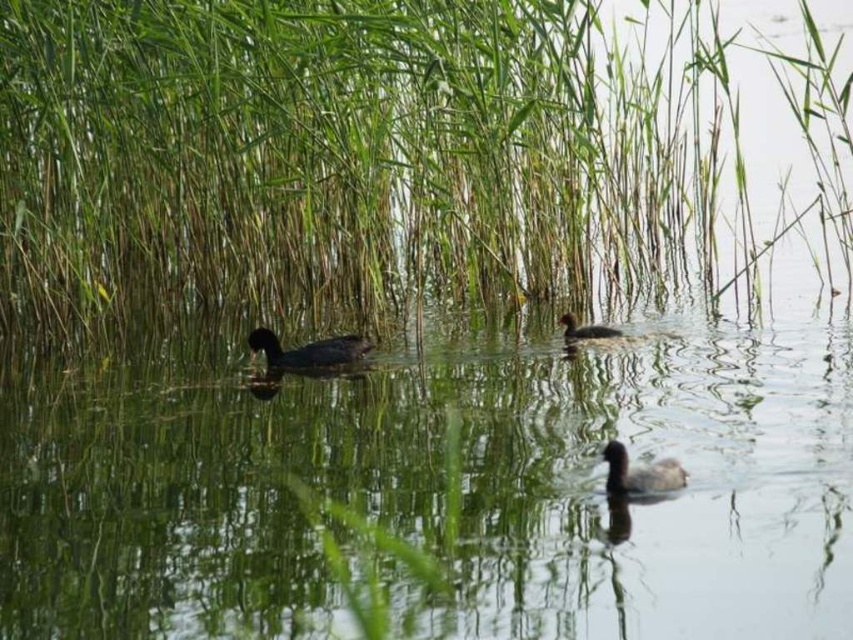
Between point (643, 492) and point (602, 326), which one is positioned in front?

Positioned in front is point (643, 492).

Can you confirm if dark gray matte duck at lower right is positioned above dark brown feathers at center?

Actually, dark gray matte duck at lower right is below dark brown feathers at center.

Does point (624, 477) lie behind point (606, 336)?

No.

The image size is (853, 640). Identify the location of dark gray matte duck at lower right. [640, 472].

Does point (602, 188) come behind point (595, 328)?

Yes, it is.

Does green leafy grass at center have a greater width compared to dark brown feathers at center?

No, green leafy grass at center is not wider than dark brown feathers at center.

What do you see at coordinates (338, 157) in the screenshot? I see `green leafy grass at center` at bounding box center [338, 157].

The image size is (853, 640). Find the location of `green leafy grass at center`. green leafy grass at center is located at coordinates [x=338, y=157].

Does point (283, 368) lie behind point (573, 323)?

Yes, it is.

Locate an element on the screen. This screenshot has height=640, width=853. dark brown matte duck at center is located at coordinates (308, 349).